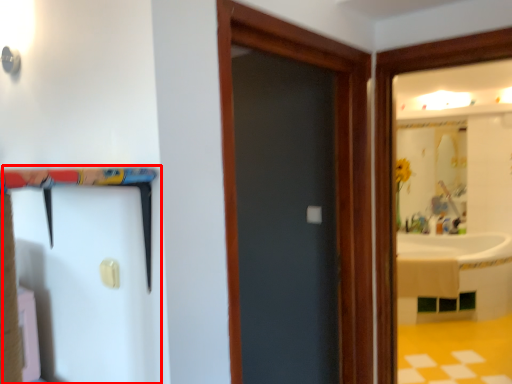
Question: From the image's perspective, what is the correct spatial positioning of barn door (annotated by the red box) in reference to door?

Choices:
 (A) below
 (B) above

Answer: (A)